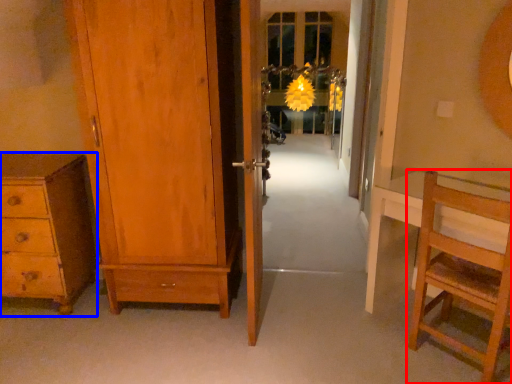
Question: Which point is closer to the camera, furniture (highlighted by a red box) or chest of drawers (highlighted by a blue box)?

Choices:
 (A) furniture
 (B) chest of drawers

Answer: (A)